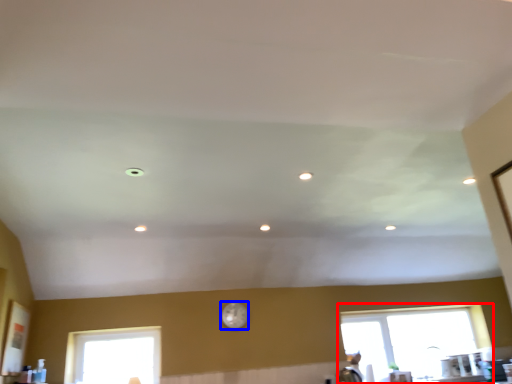
Question: Which point is further to the camera, window (highlighted by a red box) or clock (highlighted by a blue box)?

Choices:
 (A) window
 (B) clock

Answer: (A)